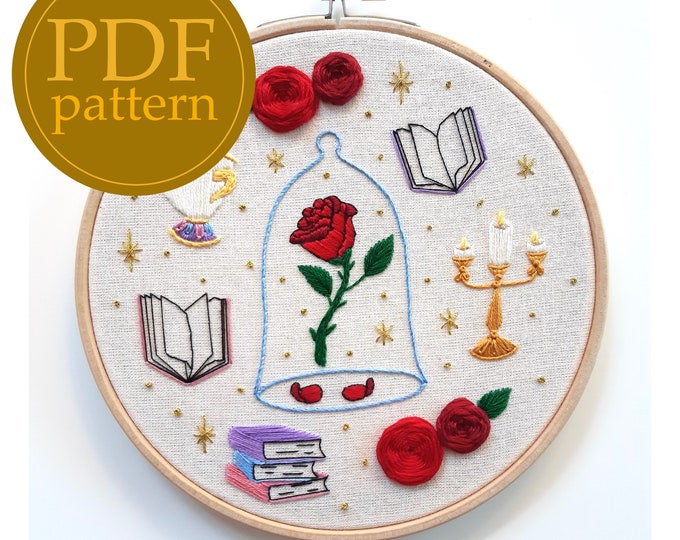
In order to click on light blue book in this screenshot , I will do `click(245, 467)`.